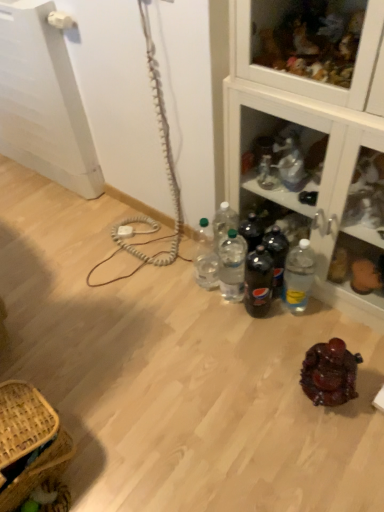
Question: Is clear plastic bottle at lower right, which is counted as the fifth bottle, starting from the left, in front of or behind brown woven picnic basket at lower left in the image?

Choices:
 (A) front
 (B) behind

Answer: (B)

Question: In terms of width, does clear plastic bottle at lower right, which appears as the 1th bottle when viewed from the right, look wider or thinner when compared to brown woven picnic basket at lower left?

Choices:
 (A) thin
 (B) wide

Answer: (A)

Question: Which is nearer to the clear plastic bottles at center, marked as the second bottle in a left-to-right arrangement?

Choices:
 (A) clear plastic bottle at lower right, which is counted as the fifth bottle, starting from the left
 (B) clear plastic bottles at center, the fifth bottle positioned from the right
 (C) shiny brown candy at center
 (D) clear glass cabinet at upper right
 (E) brown woven picnic basket at lower left

Answer: (B)

Question: Which object is positioned farthest from the clear glass cabinet at upper right?

Choices:
 (A) clear plastic bottle at lower right, which is counted as the fifth bottle, starting from the left
 (B) brown woven picnic basket at lower left
 (C) clear plastic bottles at center, the fifth bottle positioned from the right
 (D) shiny brown candy at center
 (E) translucent plastic soda bottles at center, the fourth bottle from the left

Answer: (B)